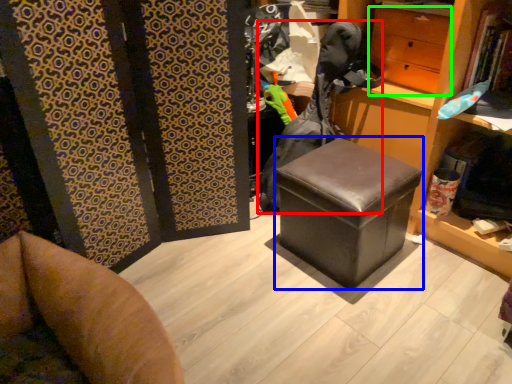
Question: Which object is positioned closest to clothing (highlighted by a red box)? Select from stool (highlighted by a blue box) and drawer (highlighted by a green box).

Choices:
 (A) stool
 (B) drawer

Answer: (B)